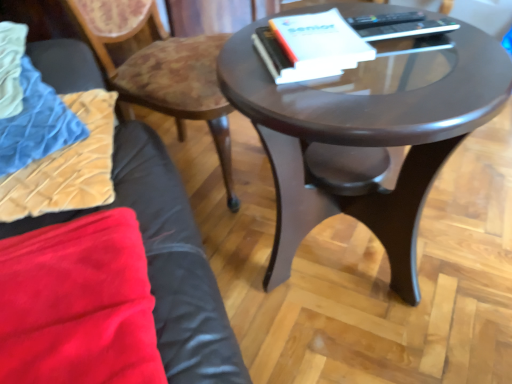
This screenshot has height=384, width=512. What are the coordinates of `free space underneath glossy dark wood coffee table at center (from a real-world perspective)` in the screenshot? It's located at (339, 266).